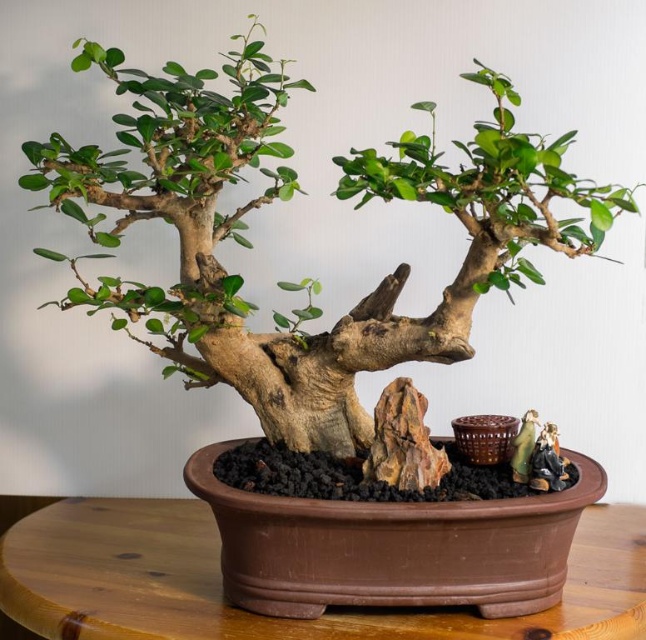
Does brown textured bonsai tree at center appear over brown wooden table at center?

Correct, brown textured bonsai tree at center is located above brown wooden table at center.

Is point (245, 45) less distant than point (85, 524)?

Yes, it is.

Does point (140, 147) lie behind point (191, 614)?

Yes.

Locate an element on the screen. The height and width of the screenshot is (640, 646). brown textured bonsai tree at center is located at coordinates (286, 198).